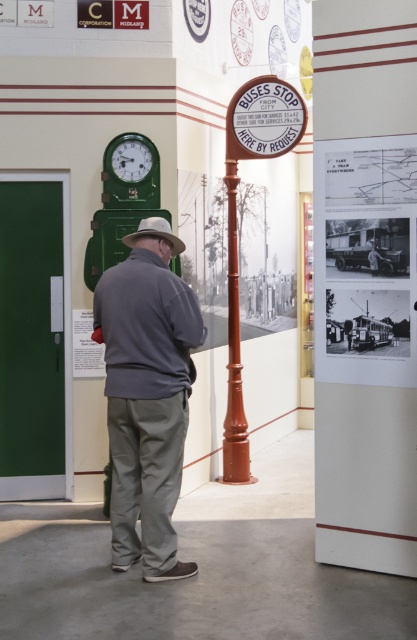
Does gray cotton jacket at center have a smaller size compared to light brown felt hat at center?

No, gray cotton jacket at center is not smaller than light brown felt hat at center.

Which is behind, point (156, 480) or point (152, 225)?

Point (152, 225)

At what (x,y) coordinates should I click in order to perform the action: click on gray cotton jacket at center. Please return your answer as a coordinate pair (x, y). Image resolution: width=417 pixels, height=640 pixels. Looking at the image, I should click on (147, 394).

Who is more distant from viewer, (407, 253) or (147, 163)?

Point (147, 163)

Between black paper at upper right and matte green clock at left, which one has more height?

Standing taller between the two is black paper at upper right.

The width and height of the screenshot is (417, 640). What do you see at coordinates (364, 259) in the screenshot?
I see `black paper at upper right` at bounding box center [364, 259].

The height and width of the screenshot is (640, 417). Identify the location of black paper at upper right. (364, 259).

Does gray cotton jacket at center appear over smooth brown pole at upper right?

No.

In the scene shown: Who is positioned more to the left, gray cotton jacket at center or smooth brown pole at upper right?

From the viewer's perspective, gray cotton jacket at center appears more on the left side.

Is point (142, 253) positioned in front of point (250, 481)?

Yes.

At what (x,y) coordinates should I click in order to perform the action: click on gray cotton jacket at center. Please return your answer as a coordinate pair (x, y). The width and height of the screenshot is (417, 640). Looking at the image, I should click on (147, 394).